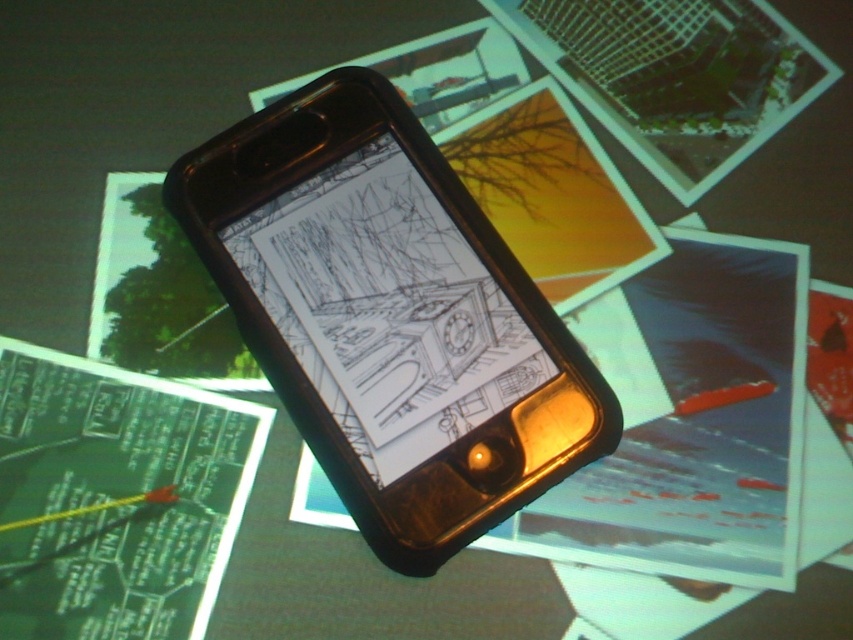
Does matte yellow paper at center come behind green paper at center?

Yes, matte yellow paper at center is behind green paper at center.

Does matte yellow paper at center appear over green paper at center?

Correct, matte yellow paper at center is located above green paper at center.

I want to click on matte yellow paper at center, so click(694, 422).

Is point (492, 406) positioned after point (163, 564)?

Yes.

Does black plastic smartphone at center appear under green paper at center?

Incorrect, black plastic smartphone at center is not positioned below green paper at center.

The width and height of the screenshot is (853, 640). What are the coordinates of `black plastic smartphone at center` in the screenshot? It's located at (x=390, y=317).

Does black plastic smartphone at center have a lesser width compared to matte yellow paper at center?

In fact, black plastic smartphone at center might be wider than matte yellow paper at center.

In the scene shown: Who is more distant from viewer, (x=425, y=376) or (x=672, y=332)?

The point (x=672, y=332) is more distant.

At what (x,y) coordinates should I click in order to perform the action: click on black plastic smartphone at center. Please return your answer as a coordinate pair (x, y). This screenshot has height=640, width=853. Looking at the image, I should click on (390, 317).